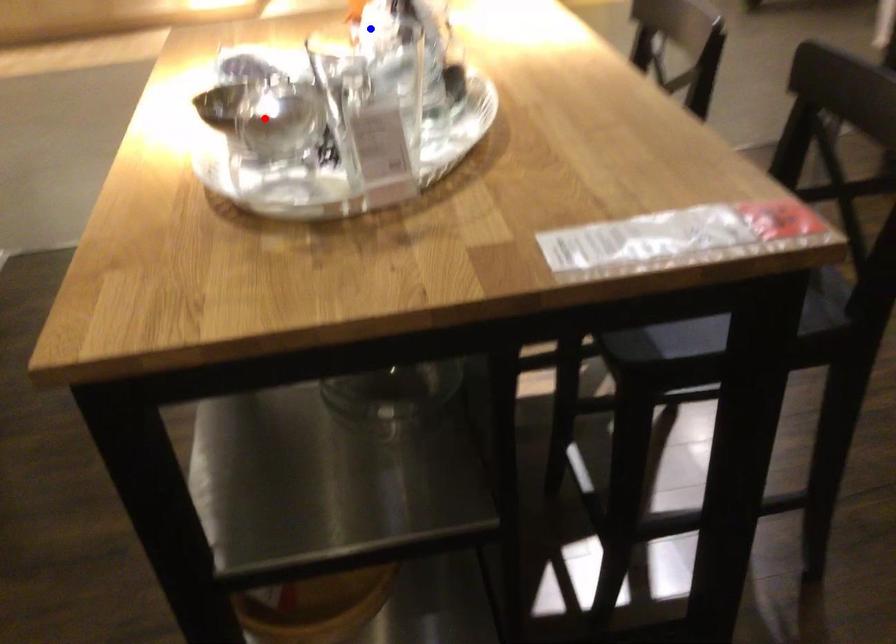
Question: Which of the two points in the image is closer to the camera?

Choices:
 (A) Blue point is closer.
 (B) Red point is closer.

Answer: (B)